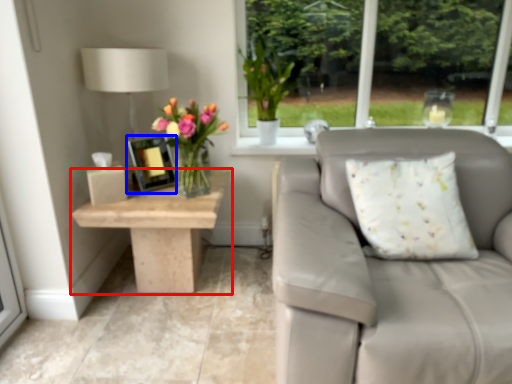
Question: Which object appears farthest to the camera in this image, table (highlighted by a red box) or picture frame (highlighted by a blue box)?

Choices:
 (A) table
 (B) picture frame

Answer: (B)